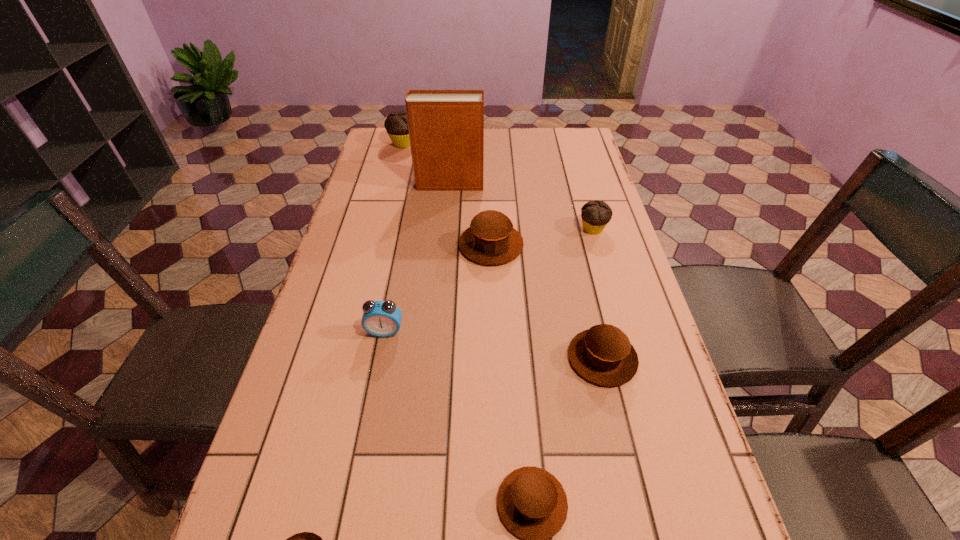
Locate an element on the screen. Image resolution: width=960 pixels, height=540 pixels. vacant area situated 0.350m on the open cover of the tallest object is located at coordinates (590, 184).

This screenshot has height=540, width=960. What are the coordinates of `free space located on the front of the farthest object` in the screenshot? It's located at (386, 214).

The height and width of the screenshot is (540, 960). What are the coordinates of `free space located 0.050m on the front of the biggest brown muffin` in the screenshot? It's located at (492, 281).

Identify the location of free region located 0.290m on the face of the alarm clock. This screenshot has width=960, height=540. (359, 467).

Where is `vacant space positioned 0.120m on the left of the second biggest brown muffin`? Image resolution: width=960 pixels, height=540 pixels. vacant space positioned 0.120m on the left of the second biggest brown muffin is located at coordinates (513, 358).

At what (x,y) coordinates should I click in order to perform the action: click on vacant space located 0.240m on the back of the smaller chocolate muffin. Please return your answer as a coordinate pair (x, y). The image size is (960, 540). Looking at the image, I should click on (578, 176).

In order to click on object that is at the far edge in this screenshot , I will do `click(396, 125)`.

The height and width of the screenshot is (540, 960). Identify the location of muffin that is positioned at the left edge. (396, 125).

At what (x,y) coordinates should I click in order to perform the action: click on alarm clock positioned at the left edge. Please return your answer as a coordinate pair (x, y). This screenshot has height=540, width=960. Looking at the image, I should click on (380, 318).

Where is `object at the far left corner`? object at the far left corner is located at coordinates (396, 125).